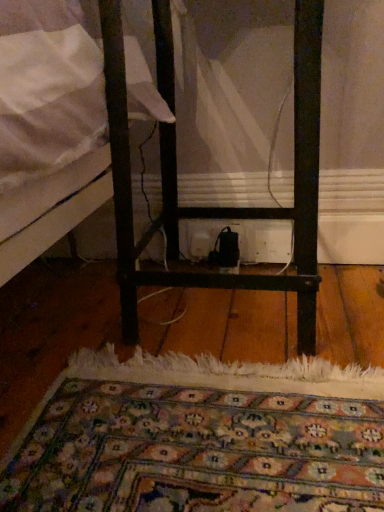
Where is `free space on the front side of white plastic electric outlet at center`? free space on the front side of white plastic electric outlet at center is located at coordinates (217, 301).